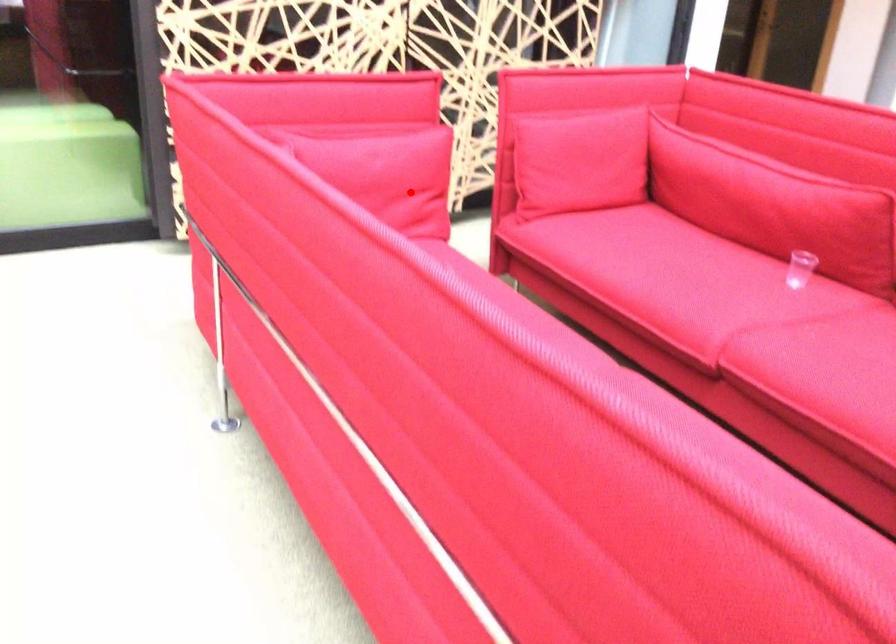
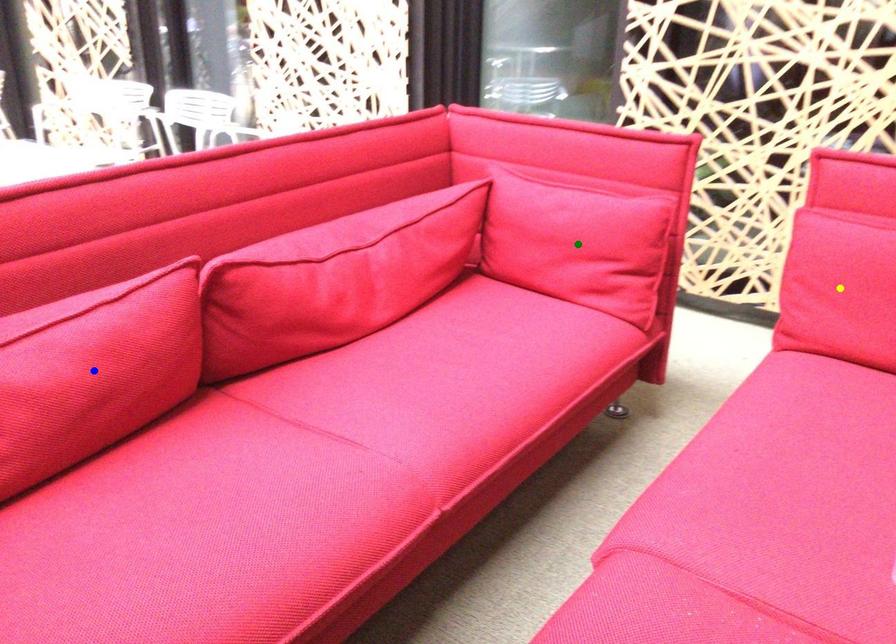
Question: I am providing you with two images of the same scene from different viewpoints. A red point is marked on the first image. You are given multiple points on the second image. Which spot in image 2 lines up with the point in image 1?

Choices:
 (A) green point
 (B) yellow point
 (C) blue point

Answer: (A)